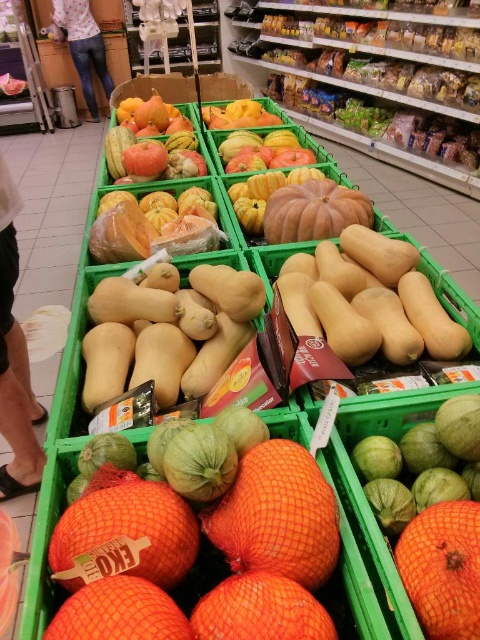
Who is higher up, netted orange fruit at center or shiny orange melon at center?

shiny orange melon at center

Does netted orange fruit at center appear under shiny orange melon at center?

Yes.

The height and width of the screenshot is (640, 480). Describe the element at coordinates (219, 550) in the screenshot. I see `netted orange fruit at center` at that location.

Locate an element on the screen. Image resolution: width=480 pixels, height=640 pixels. netted orange fruit at center is located at coordinates (219, 550).

Between netted orange fruit at center and ripe red apples at center, which one has more height?

Standing taller between the two is ripe red apples at center.

Is point (105, 600) farther from viewer compared to point (273, 157)?

No.

What do you see at coordinates (219, 550) in the screenshot?
I see `netted orange fruit at center` at bounding box center [219, 550].

Image resolution: width=480 pixels, height=640 pixels. Identify the location of netted orange fruit at center. (219, 550).

Who is positioned more to the left, smooth orange pumpkin at upper left or ripe red apples at center?

From the viewer's perspective, smooth orange pumpkin at upper left appears more on the left side.

Is point (169, 177) positioned in front of point (252, 145)?

Yes.

Which is in front, point (162, 131) or point (255, 136)?

Point (255, 136) is in front.

Locate an element on the screen. This screenshot has height=640, width=480. smooth orange pumpkin at upper left is located at coordinates (156, 140).